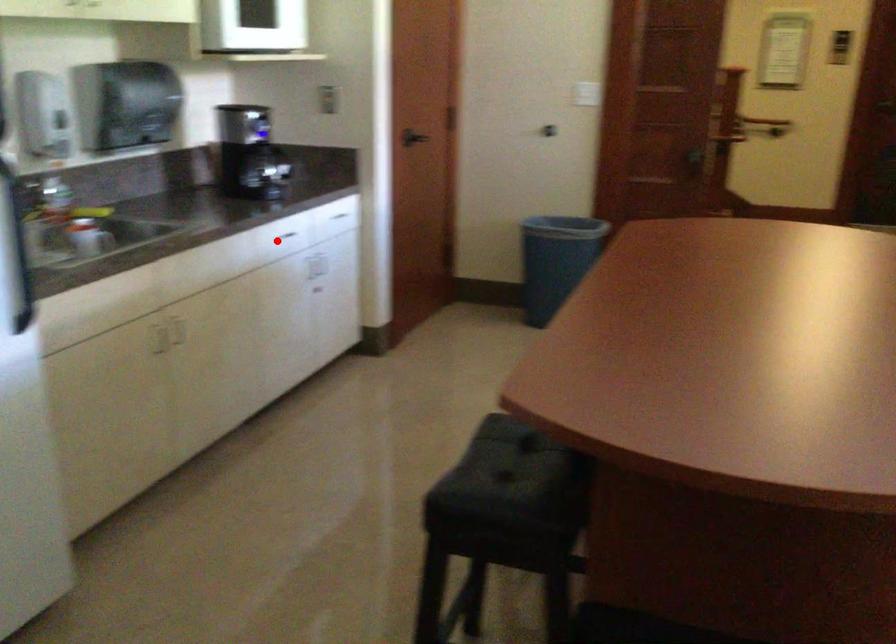
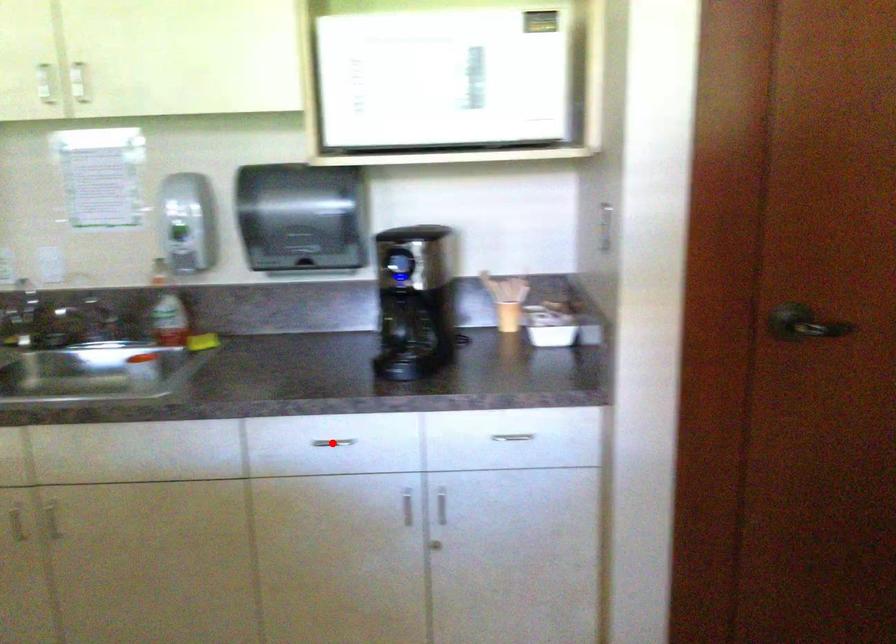
I am providing you with two images of the same scene from different viewpoints. A red point is marked on the first image and another point is marked on the second image. Is the red point in image1 aligned with the point shown in image2?

Yes